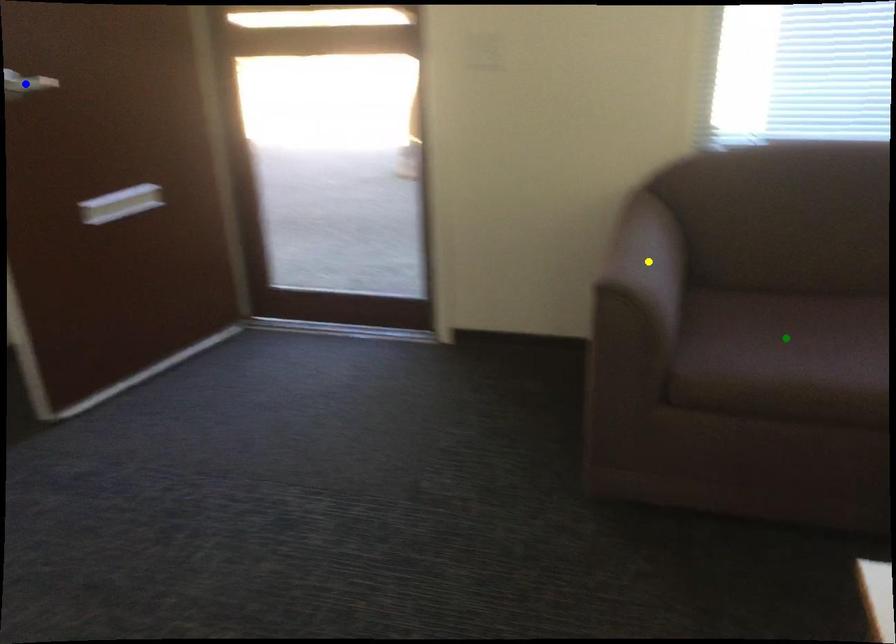
Order these from nearest to farthest:
yellow point | blue point | green point

blue point, green point, yellow point